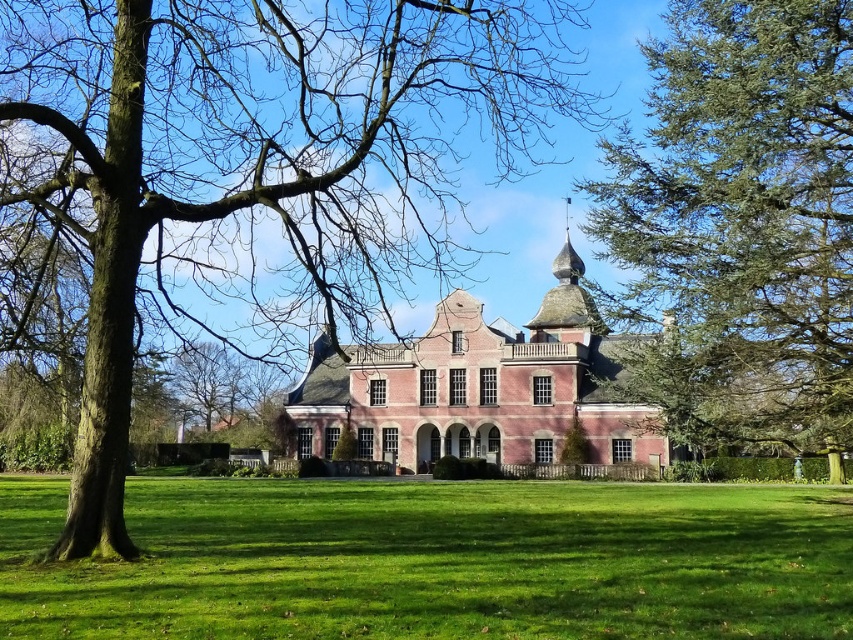
Question: Among these points, which one is farthest from the camera?

Choices:
 (A) (831, 160)
 (B) (392, 554)

Answer: (A)

Question: Which object is the closest to the green grass at center?

Choices:
 (A) green needle-like tree at upper right
 (B) brick mansion at center

Answer: (A)

Question: Based on their relative distances, which object is farther from the brown bark tree at center?

Choices:
 (A) green grass at center
 (B) brick mansion at center

Answer: (A)

Question: From the image, what is the correct spatial relationship of green needle-like tree at upper right in relation to brick mansion at center?

Choices:
 (A) below
 (B) above

Answer: (B)

Question: Does green needle-like tree at upper right appear over brick mansion at center?

Choices:
 (A) yes
 (B) no

Answer: (A)

Question: Can you confirm if brown bark tree at center is positioned above green grass at center?

Choices:
 (A) no
 (B) yes

Answer: (B)